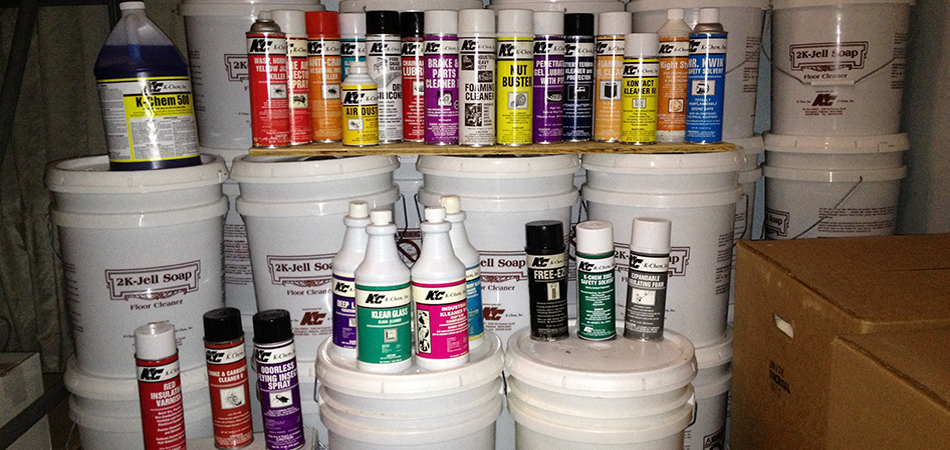
You are a GUI agent. You are given a task and a screenshot of the screen. Output one action in this format:
    pyautogui.click(x=<x>, y=<y>)
    Task: Click on the soap bucket
    This screenshot has width=950, height=450.
    Given the screenshot: What is the action you would take?
    pyautogui.click(x=830, y=17)